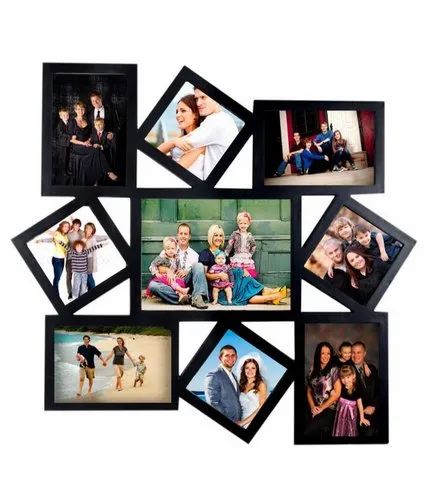
This screenshot has height=500, width=427. I want to click on pictures, so click(125, 373), click(231, 371), click(341, 386), click(334, 261), click(223, 273), click(77, 238), click(75, 151), click(186, 139), click(307, 153).